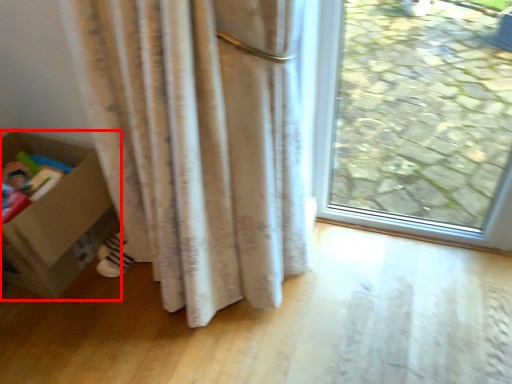
Question: From the image's perspective, what is the correct spatial relationship of box (annotated by the red box) in relation to footwear?

Choices:
 (A) below
 (B) above

Answer: (B)